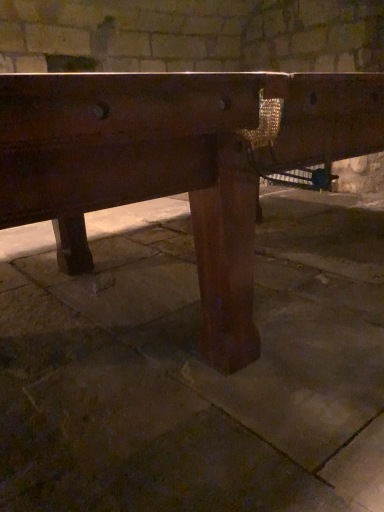
This screenshot has width=384, height=512. In order to click on brown wood table at center in this screenshot , I will do `click(194, 367)`.

What do you see at coordinates (194, 367) in the screenshot?
I see `brown wood table at center` at bounding box center [194, 367].

Where is `brown wood table at center`? The width and height of the screenshot is (384, 512). brown wood table at center is located at coordinates (194, 367).